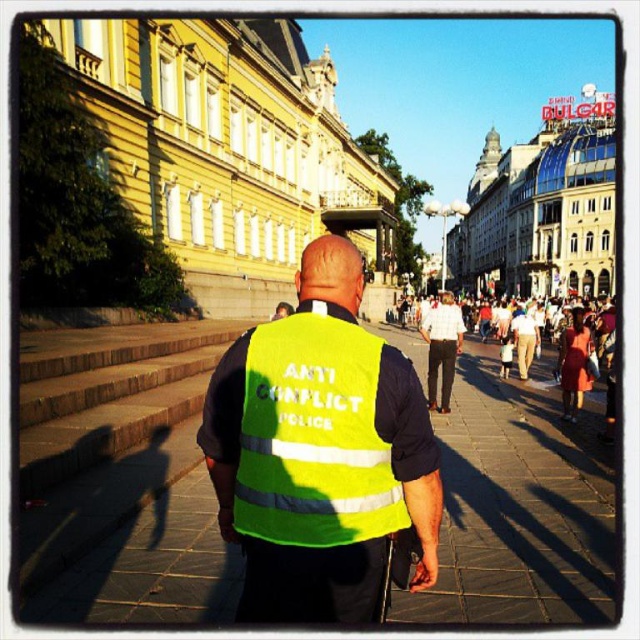
Question: Which point is farther to the camera?

Choices:
 (A) (436, 515)
 (B) (445, 353)
 (C) (99, 576)

Answer: (B)

Question: Does high-visibility fabric vest at center appear on the left side of white shirt at center?

Choices:
 (A) no
 (B) yes

Answer: (B)

Question: Is neon yellow reflective vest at center bigger than white shirt at center?

Choices:
 (A) no
 (B) yes

Answer: (A)

Question: Based on their relative distances, which object is farther from the yellow reflective vest at center?

Choices:
 (A) white shirt at center
 (B) high-visibility fabric vest at center

Answer: (A)

Question: Considering the relative positions of yellow reflective vest at center and high-visibility fabric vest at center in the image provided, where is yellow reflective vest at center located with respect to high-visibility fabric vest at center?

Choices:
 (A) right
 (B) left

Answer: (A)

Question: Considering the real-world distances, which object is farthest from the white shirt at center?

Choices:
 (A) neon yellow reflective vest at center
 (B) high-visibility fabric vest at center

Answer: (B)